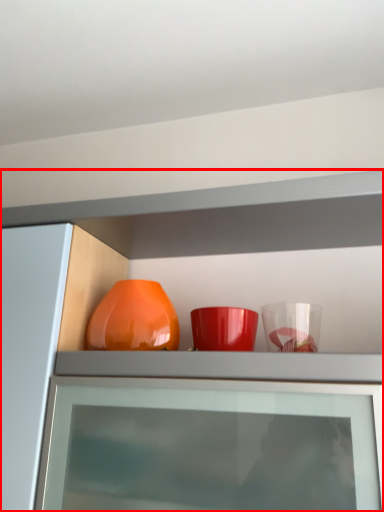
Question: From the image's perspective, where is cabinetry (annotated by the red box) located relative to vase?

Choices:
 (A) below
 (B) above

Answer: (A)